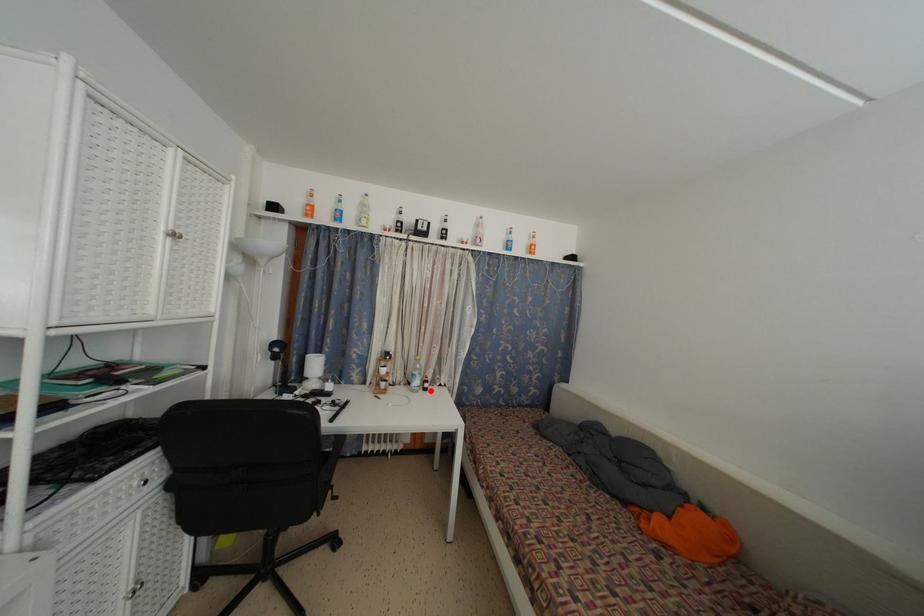
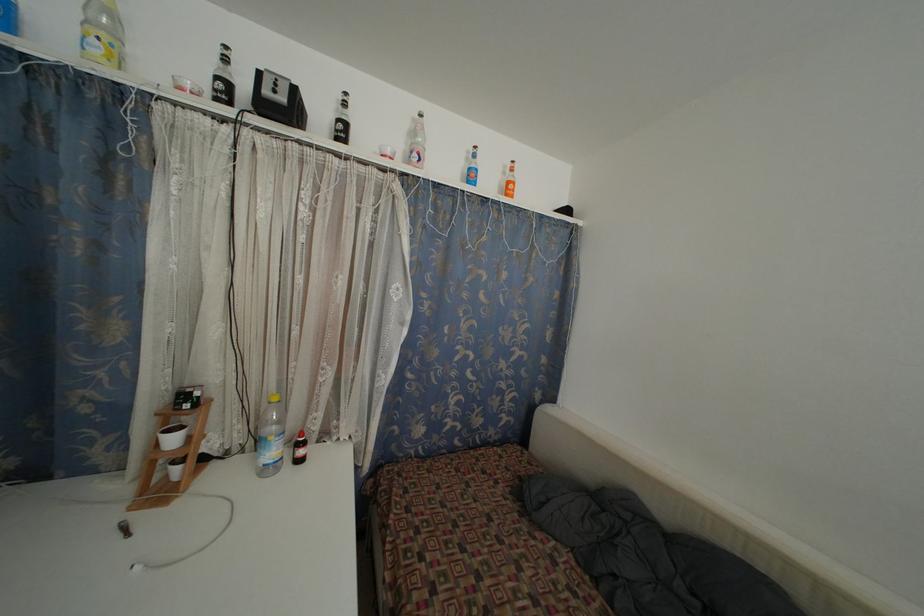
Question: I am providing you with two images of the same scene from different viewpoints. In image1, a red point is highlighted. Considering the same 3D point in image2, which of the following is correct?

Choices:
 (A) It is closer
 (B) It is farther

Answer: (A)